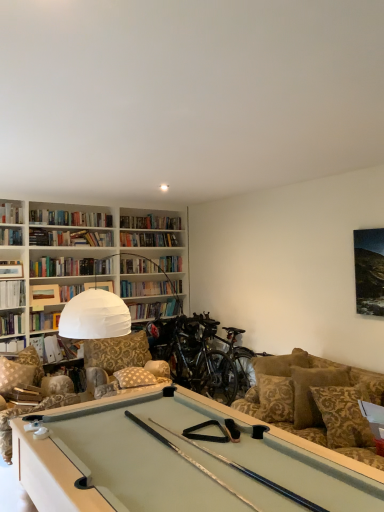
The height and width of the screenshot is (512, 384). What do you see at coordinates (296, 393) in the screenshot? I see `patterned fabric couch at lower right` at bounding box center [296, 393].

Describe the element at coordinates (52, 294) in the screenshot. The image size is (384, 512). I see `matte white book at upper left, placed as the fourth book when sorted from top to bottom` at that location.

At what (x,y) coordinates should I click in order to perform the action: click on hardcover book at left, acting as the first book starting from the top. Please return your answer as a coordinate pair (x, y). The height and width of the screenshot is (512, 384). Looking at the image, I should click on (11, 213).

What do you see at coordinates (61, 348) in the screenshot? I see `hardcover book at left, which is the first book from bottom to top` at bounding box center [61, 348].

How much space does brown damask pillow at right, which appears as the first pillow when viewed from the right, occupy vertically?

brown damask pillow at right, which appears as the first pillow when viewed from the right, is 20.94 inches tall.

Image resolution: width=384 pixels, height=512 pixels. What are the coordinates of `patterned fabric couch at lower right` in the screenshot? It's located at (296, 393).

From a real-world perspective, is patterned fabric couch at lower right physically above hardcover book at left, the fifth book positioned from the top?

Actually, patterned fabric couch at lower right is physically below hardcover book at left, the fifth book positioned from the top, in the real world.

Which is more to the left, patterned fabric couch at lower right or hardcover book at left, the fifth book positioned from the top?

hardcover book at left, the fifth book positioned from the top.

From the picture: Is patterned fabric couch at lower right directly adjacent to hardcover book at left, which is the first book from bottom to top?

No, patterned fabric couch at lower right is not touching hardcover book at left, which is the first book from bottom to top.

From the picture: Which of these two, patterned fabric couch at lower right or hardcover book at left, which is the first book from bottom to top, is thinner?

hardcover book at left, which is the first book from bottom to top.

Consider the image. Which object is thinner, hardcover book at upper left, the second book viewed from the top, or hardcover book at left, acting as the first book starting from the top?

With smaller width is hardcover book at upper left, the second book viewed from the top.

Considering their positions, is hardcover book at upper left, the fourth book positioned from the bottom, located in front of or behind hardcover book at left, acting as the first book starting from the top?

Visually, hardcover book at upper left, the fourth book positioned from the bottom, is located in front of hardcover book at left, acting as the first book starting from the top.

Between point (5, 262) and point (13, 212), which one is positioned in front?

The point (5, 262) is more forward.

From the image's perspective, is silver metallic mountain bike at center, the second mountain bike viewed from the left, above brown textured pillow at right, the second pillow from the right?

Answer: Actually, silver metallic mountain bike at center, the second mountain bike viewed from the left, appears below brown textured pillow at right, the second pillow from the right, in the image.

Considering their positions, is silver metallic mountain bike at center, the second mountain bike viewed from the left, located in front of or behind brown textured pillow at right, the second pillow from the right?

silver metallic mountain bike at center, the second mountain bike viewed from the left, is behind brown textured pillow at right, the second pillow from the right.

Which of these two, silver metallic mountain bike at center, the second mountain bike viewed from the left, or brown textured pillow at right, the 2th pillow when ordered from front to back, stands taller?

With more height is silver metallic mountain bike at center, the second mountain bike viewed from the left.

From the image's perspective, starting from the brown textured pillow at right, the 2th pillow when ordered from back to front, which mountain bike is the 2nd one below? Please provide its 2D coordinates.

[(233, 351)]

Does patterned fabric pillow at center, the 3th pillow viewed from the right, have a larger size compared to matte white book at upper left, placed as the fourth book when sorted from top to bottom?

Indeed, patterned fabric pillow at center, the 3th pillow viewed from the right, has a larger size compared to matte white book at upper left, placed as the fourth book when sorted from top to bottom.

From the image's perspective, does patterned fabric pillow at center, the first pillow when ordered from back to front, appear lower than matte white book at upper left, placed as the fourth book when sorted from top to bottom?

Indeed, from the image's perspective, patterned fabric pillow at center, the first pillow when ordered from back to front, is shown beneath matte white book at upper left, placed as the fourth book when sorted from top to bottom.

Looking at this image, from a real-world perspective, is patterned fabric pillow at center, the 3th pillow viewed from the right, under matte white book at upper left, positioned as the 2th book in bottom-to-top order?

Correct, in the physical world, patterned fabric pillow at center, the 3th pillow viewed from the right, is lower than matte white book at upper left, positioned as the 2th book in bottom-to-top order.

Which of these two, patterned fabric pillow at center, which is the 3th pillow in front-to-back order, or matte white book at upper left, placed as the fourth book when sorted from top to bottom, stands taller?

matte white book at upper left, placed as the fourth book when sorted from top to bottom.

In the scene shown: Can you tell me how much silver metallic mountain bike at center, the second mountain bike viewed from the left, and hardcover book at left, the fifth book positioned from the top, differ in facing direction?

95.6 degrees separate the facing orientations of silver metallic mountain bike at center, the second mountain bike viewed from the left, and hardcover book at left, the fifth book positioned from the top.

Considering their positions, is silver metallic mountain bike at center, which appears as the 1th mountain bike when viewed from the right, located in front of or behind hardcover book at left, which is the first book from bottom to top?

silver metallic mountain bike at center, which appears as the 1th mountain bike when viewed from the right, is positioned closer to the viewer than hardcover book at left, which is the first book from bottom to top.

Is silver metallic mountain bike at center, which appears as the 1th mountain bike when viewed from the right, next to hardcover book at left, the fifth book positioned from the top?

silver metallic mountain bike at center, which appears as the 1th mountain bike when viewed from the right, and hardcover book at left, the fifth book positioned from the top, are not in contact.

Considering the sizes of objects silver metallic mountain bike at center, which appears as the 1th mountain bike when viewed from the right, and hardcover book at left, which is the first book from bottom to top, in the image provided, who is shorter, silver metallic mountain bike at center, which appears as the 1th mountain bike when viewed from the right, or hardcover book at left, which is the first book from bottom to top,?

Standing shorter between the two is hardcover book at left, which is the first book from bottom to top.

Based on the photo, does shiny black mountain bike at center, placed as the first mountain bike when sorted from left to right, have a larger size compared to hardcover book at upper left, the second book viewed from the top?

Indeed, shiny black mountain bike at center, placed as the first mountain bike when sorted from left to right, has a larger size compared to hardcover book at upper left, the second book viewed from the top.

Between shiny black mountain bike at center, positioned as the second mountain bike in right-to-left order, and hardcover book at upper left, the second book viewed from the top, which one appears on the left side from the viewer's perspective?

Positioned to the left is hardcover book at upper left, the second book viewed from the top.

Is shiny black mountain bike at center, placed as the first mountain bike when sorted from left to right, situated inside hardcover book at upper left, the fourth book positioned from the bottom, or outside?

shiny black mountain bike at center, placed as the first mountain bike when sorted from left to right, exists outside the volume of hardcover book at upper left, the fourth book positioned from the bottom.

Does camouflage fabric swivel chair at lower left come behind shiny black mountain bike at center, placed as the first mountain bike when sorted from left to right?

No, camouflage fabric swivel chair at lower left is closer to the viewer.

From a real-world perspective, is camouflage fabric swivel chair at lower left physically below shiny black mountain bike at center, placed as the first mountain bike when sorted from left to right?

Yes, from a real-world perspective, camouflage fabric swivel chair at lower left is under shiny black mountain bike at center, placed as the first mountain bike when sorted from left to right.

Is camouflage fabric swivel chair at lower left not inside shiny black mountain bike at center, placed as the first mountain bike when sorted from left to right?

Yes, camouflage fabric swivel chair at lower left is outside of shiny black mountain bike at center, placed as the first mountain bike when sorted from left to right.

Can you confirm if camouflage fabric swivel chair at lower left is thinner than shiny black mountain bike at center, placed as the first mountain bike when sorted from left to right?

Incorrect, the width of camouflage fabric swivel chair at lower left is not less than that of shiny black mountain bike at center, placed as the first mountain bike when sorted from left to right.

Locate an element on the screen. The image size is (384, 512). book below the patterned fabric couch at lower right (from the image's perspective) is located at coordinates (61, 348).

Starting from the hardcover book at left, acting as the first book starting from the top, which book is the 1st one in front? Please provide its 2D coordinates.

[(11, 269)]

Looking at this image, considering their positions, is brown textured pillow at right, the 2th pillow when ordered from front to back, positioned closer to hardcover book at left, acting as the first book starting from the top, than matte white book at upper left, placed as the fourth book when sorted from top to bottom?

matte white book at upper left, placed as the fourth book when sorted from top to bottom, is closer to hardcover book at left, acting as the first book starting from the top.

Looking at this image, when comparing their distances from silver metallic mountain bike at center, the second mountain bike viewed from the left, does hardcover book at left, the fifth book positioned from the top, or hardcover book at left, which ranks as the 3th book in bottom-to-top order, seem closer?

Answer: hardcover book at left, the fifth book positioned from the top, is positioned closer to the anchor silver metallic mountain bike at center, the second mountain bike viewed from the left.

Looking at the image, which one is located closer to shiny black mountain bike at center, positioned as the second mountain bike in right-to-left order, hardcover book at left, which ranks as the 3th book in bottom-to-top order, or patterned fabric couch at lower right?

Based on the image, patterned fabric couch at lower right appears to be nearer to shiny black mountain bike at center, positioned as the second mountain bike in right-to-left order.

Looking at the image, which one is located further to hardcover book at left, acting as the first book starting from the top, hardcover book at upper left, the second book viewed from the top, or patterned fabric pillow at center, the 3th pillow viewed from the right?

patterned fabric pillow at center, the 3th pillow viewed from the right, is further to hardcover book at left, acting as the first book starting from the top.

Looking at the image, which one is located further to silver metallic mountain bike at center, which appears as the 1th mountain bike when viewed from the right, patterned fabric couch at lower right or brown damask pillow at right, which appears as the first pillow when viewed from the right?

brown damask pillow at right, which appears as the first pillow when viewed from the right.

When comparing their distances from patterned fabric pillow at center, which is the 3th pillow in front-to-back order, does brown damask pillow at right, the third pillow positioned from the back, or silver metallic mountain bike at center, the second mountain bike viewed from the left, seem closer?

Among the two, silver metallic mountain bike at center, the second mountain bike viewed from the left, is located nearer to patterned fabric pillow at center, which is the 3th pillow in front-to-back order.

When comparing their distances from silver metallic mountain bike at center, the second mountain bike viewed from the left, does matte white book at upper left, positioned as the 2th book in bottom-to-top order, or hardcover book at left, marked as the fifth book in a bottom-to-top arrangement, seem further?

Based on the image, hardcover book at left, marked as the fifth book in a bottom-to-top arrangement, appears to be further to silver metallic mountain bike at center, the second mountain bike viewed from the left.

Which object lies nearer to the anchor point brown textured pillow at right, the 2th pillow viewed from the left, camouflage fabric swivel chair at lower left or patterned fabric pillow at center, the 3th pillow viewed from the right?

patterned fabric pillow at center, the 3th pillow viewed from the right, is positioned closer to the anchor brown textured pillow at right, the 2th pillow viewed from the left.

Find the location of `swivel chair between hardcover book at upper left, the second book viewed from the top, and patterned fabric pillow at center, the 3th pillow viewed from the right`. swivel chair between hardcover book at upper left, the second book viewed from the top, and patterned fabric pillow at center, the 3th pillow viewed from the right is located at coordinates (29, 412).

Where is `pillow between matte white book at upper left, placed as the fourth book when sorted from top to bottom, and silver metallic mountain bike at center, which appears as the 1th mountain bike when viewed from the right, from left to right`? This screenshot has width=384, height=512. pillow between matte white book at upper left, placed as the fourth book when sorted from top to bottom, and silver metallic mountain bike at center, which appears as the 1th mountain bike when viewed from the right, from left to right is located at coordinates (134, 377).

In order to click on mountain bike between hardcover book at left, which ranks as the 3th book in bottom-to-top order, and silver metallic mountain bike at center, the second mountain bike viewed from the left, from left to right in this screenshot , I will do `click(194, 357)`.

Identify the location of swivel chair between matte white book at upper left, positioned as the 2th book in bottom-to-top order, and brown textured pillow at right, the 2th pillow when ordered from back to front, from left to right. This screenshot has height=512, width=384. [x=29, y=412].